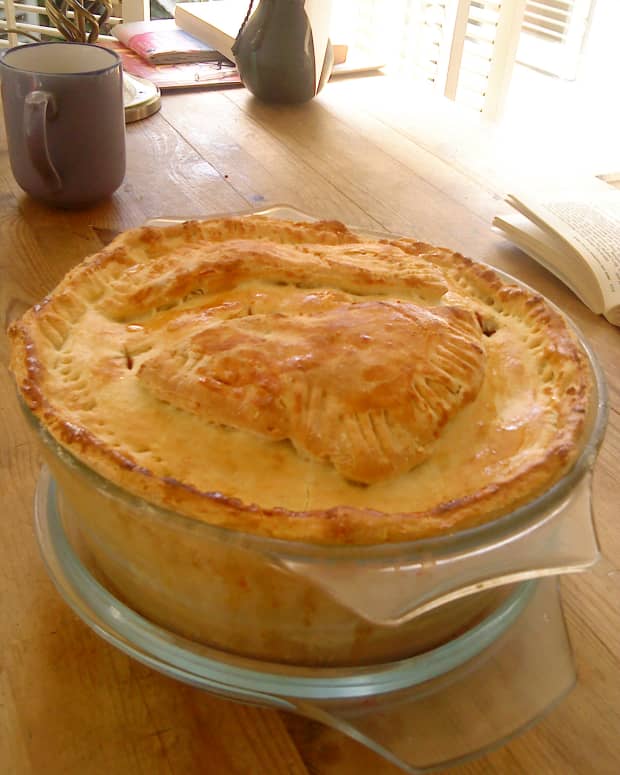
Where is `wooden table to put stuff`? The image size is (620, 775). wooden table to put stuff is located at coordinates (395, 191).